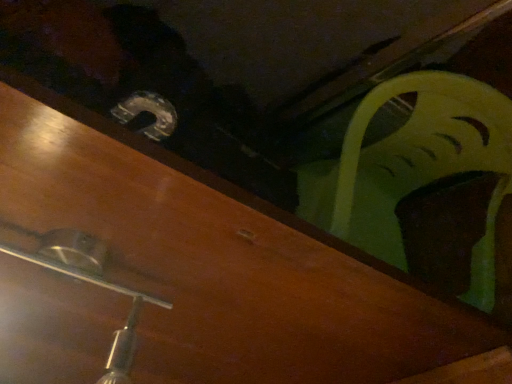
In order to face metallic silver light fixture at lower left, should I rotate leftwards or rightwards?

Rotate your view left by about 24.212°.

This screenshot has width=512, height=384. I want to click on metallic silver light fixture at lower left, so click(x=88, y=282).

What do you see at coordinates (88, 282) in the screenshot? The height and width of the screenshot is (384, 512). I see `metallic silver light fixture at lower left` at bounding box center [88, 282].

Measure the distance between metallic silver light fixture at lower left and camera.

metallic silver light fixture at lower left is 18.46 inches away from camera.

Measure the distance between point (x=67, y=233) and camera.

Point (x=67, y=233) and camera are 18.90 inches apart from each other.

Identify the location of metallic silver light fixture at lower left. (88, 282).